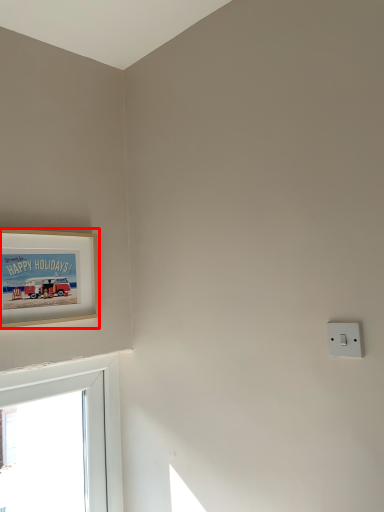
Question: Where is picture frame (annotated by the red box) located in relation to light switch in the image?

Choices:
 (A) left
 (B) right

Answer: (A)